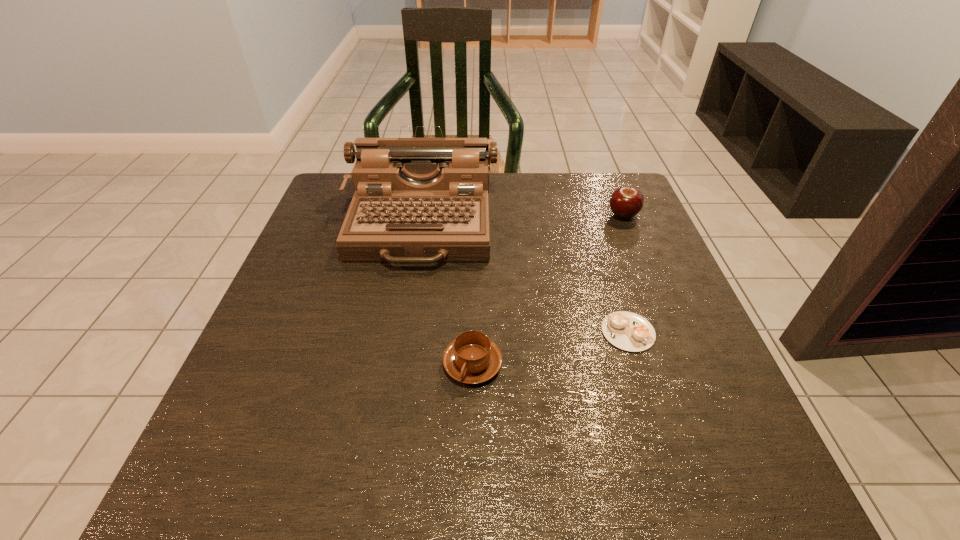
This screenshot has width=960, height=540. I want to click on typewriter that is at the far edge, so click(417, 200).

Where is `apple present at the far edge`? This screenshot has width=960, height=540. apple present at the far edge is located at coordinates (625, 202).

Locate an element on the screen. Image resolution: width=960 pixels, height=540 pixels. object that is positioned at the left edge is located at coordinates (417, 200).

You are a GUI agent. You are given a task and a screenshot of the screen. Output one action in this format:
    pyautogui.click(x=<x>, y=<y>)
    Task: Click on the apple present at the right edge
    The height and width of the screenshot is (540, 960).
    Given the screenshot: What is the action you would take?
    pyautogui.click(x=625, y=202)

The image size is (960, 540). Identify the location of cappuccino located in the right edge section of the desktop. (628, 331).

You are a GUI agent. You are given a task and a screenshot of the screen. Output one action in this format:
    pyautogui.click(x=<x>, y=<y>)
    Task: Click on the object that is at the far left corner
    
    Given the screenshot: What is the action you would take?
    point(417,200)

Identify the location of object that is positioned at the far right corner. This screenshot has height=540, width=960. (625, 202).

Where is `free space at the far edge of the desktop`? free space at the far edge of the desktop is located at coordinates (520, 204).

In the image, there is a desktop. At what (x,y) coordinates should I click in order to perform the action: click on vacant region at the near edge. Please return your answer as a coordinate pair (x, y). The height and width of the screenshot is (540, 960). Looking at the image, I should click on (312, 465).

Where is `free region at the left edge of the desktop`? free region at the left edge of the desktop is located at coordinates (332, 233).